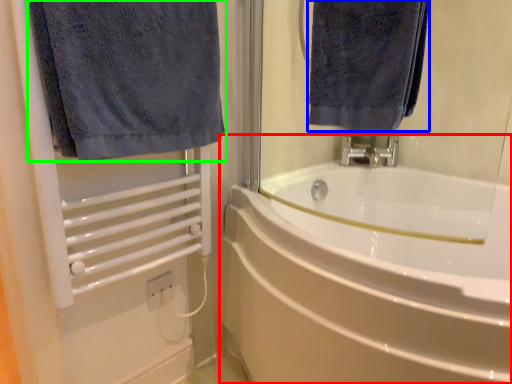
Question: Based on their relative distances, which object is nearer to bathtub (highlighted by a red box)? Choose from towel (highlighted by a blue box) and towel (highlighted by a green box).

Choices:
 (A) towel
 (B) towel

Answer: (A)